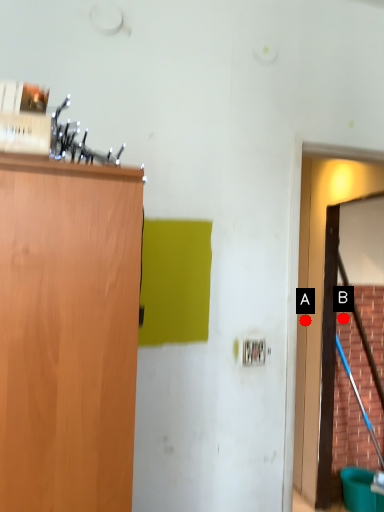
Question: Two points are circled on the image, labeled by A and B beside each circle. Which point is further to the camera?

Choices:
 (A) A is further
 (B) B is further

Answer: (B)